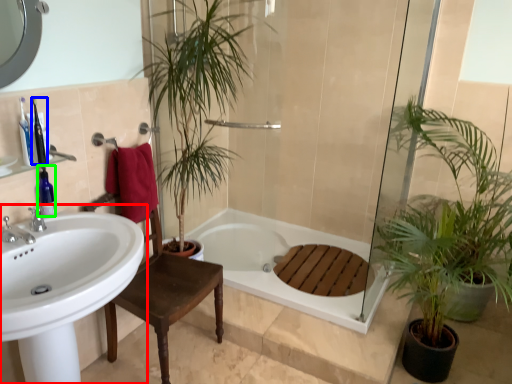
Question: Based on their relative distances, which object is farther from sink (highlighted by a red box)? Choose from toiletry (highlighted by a blue box) and toiletry (highlighted by a green box).

Choices:
 (A) toiletry
 (B) toiletry

Answer: (A)